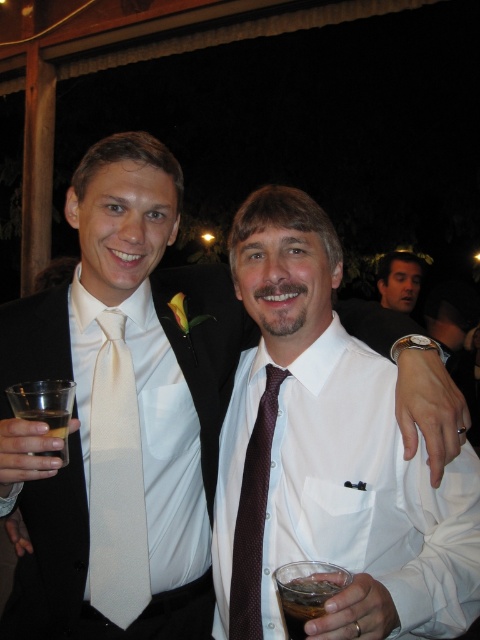
Is white satin dress shirt at center below white satin business suit at center?

Correct, white satin dress shirt at center is located below white satin business suit at center.

From the picture: Who is more distant from viewer, (408, 552) or (13, 584)?

The point (13, 584) is more distant.

This screenshot has width=480, height=640. What are the coordinates of `white satin dress shirt at center` in the screenshot? It's located at (367, 492).

Does smooth skin face at upper right appear under translucent plastic cup at lower left?

No, smooth skin face at upper right is not below translucent plastic cup at lower left.

Locate an element on the screen. The height and width of the screenshot is (640, 480). smooth skin face at upper right is located at coordinates (399, 280).

Is white satin business suit at center to the right of translucent plastic cup at lower left from the viewer's perspective?

Correct, you'll find white satin business suit at center to the right of translucent plastic cup at lower left.

I want to click on white satin business suit at center, so click(x=50, y=556).

Find the location of a particular element. white satin business suit at center is located at coordinates (50, 556).